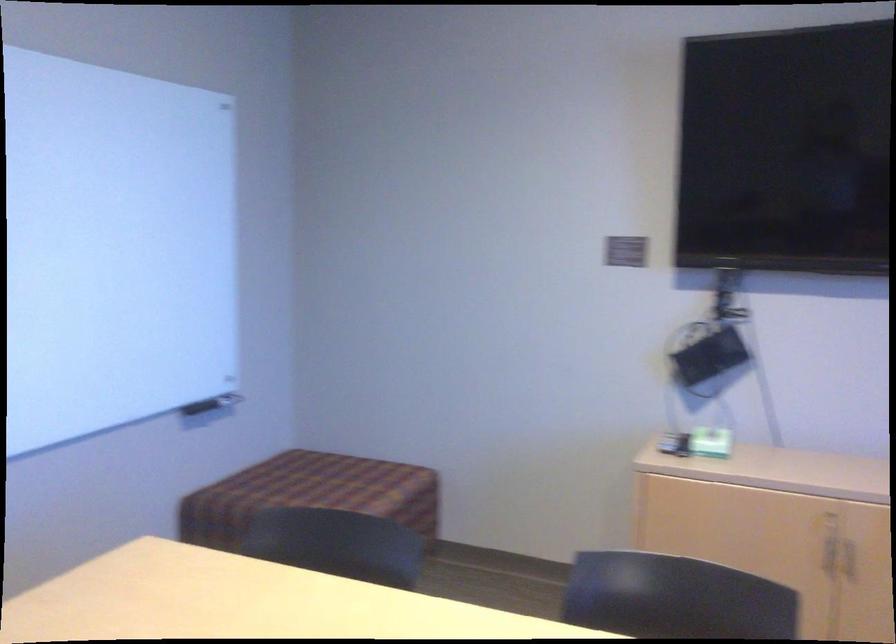
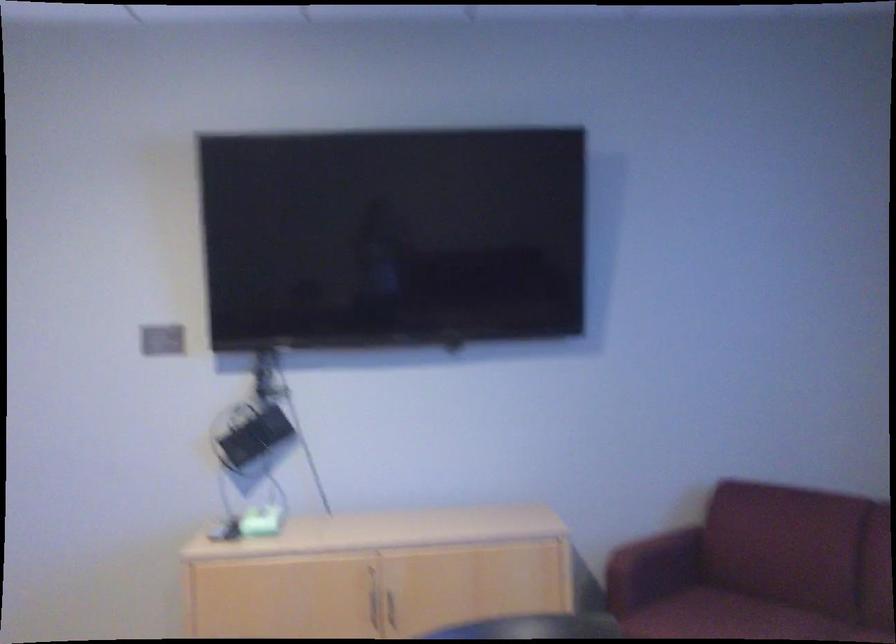
Question: How did the camera likely rotate?

Choices:
 (A) Left
 (B) Right
 (C) Up
 (D) Down

Answer: (B)